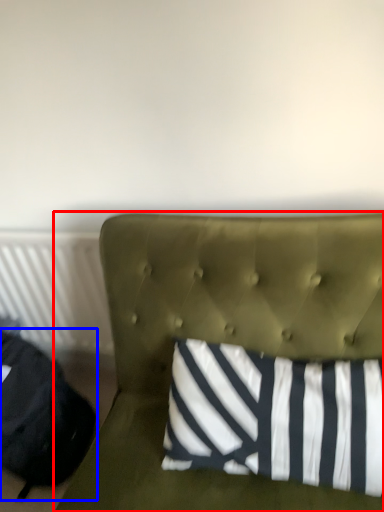
Question: Which object appears closest to the camera in this image, furniture (highlighted by a red box) or bean bag chair (highlighted by a blue box)?

Choices:
 (A) furniture
 (B) bean bag chair

Answer: (A)